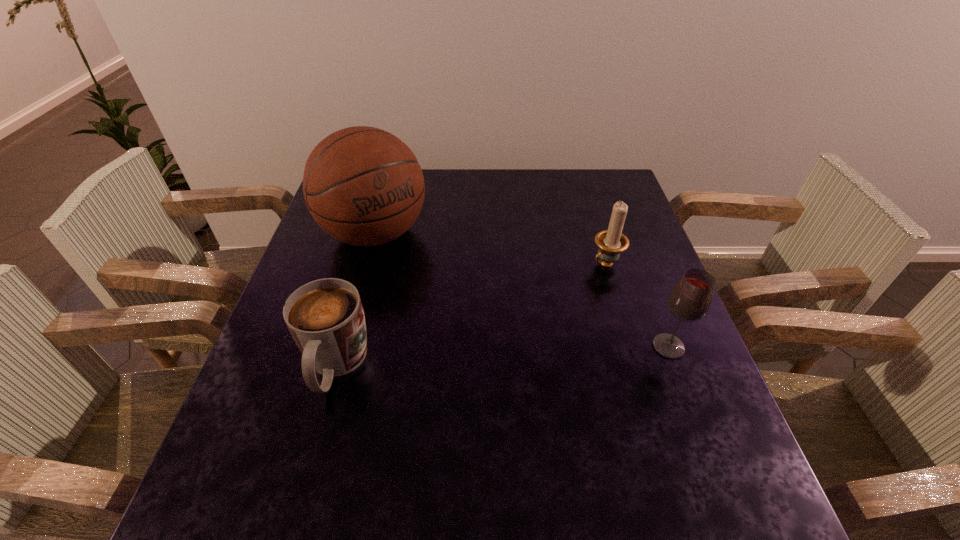
The width and height of the screenshot is (960, 540). Identify the location of the third closest object to the glass drink container. (325, 317).

Locate an element on the screen. This screenshot has height=540, width=960. vacant space that satisfies the following two spatial constraints: 1. on the front side of the rightmost object; 2. on the right side of the second object from right to left is located at coordinates [631, 347].

Identify the location of free space that satisfies the following two spatial constraints: 1. on the front side of the tallest object; 2. on the left side of the rightmost object. This screenshot has height=540, width=960. (344, 347).